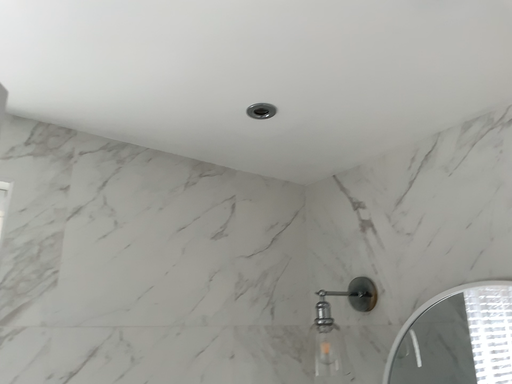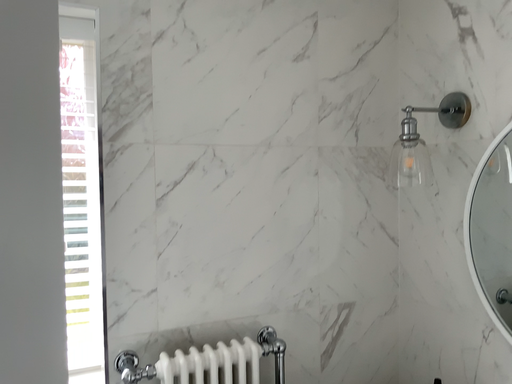
Question: How did the camera likely rotate when shooting the video?

Choices:
 (A) rotated right
 (B) rotated left

Answer: (B)